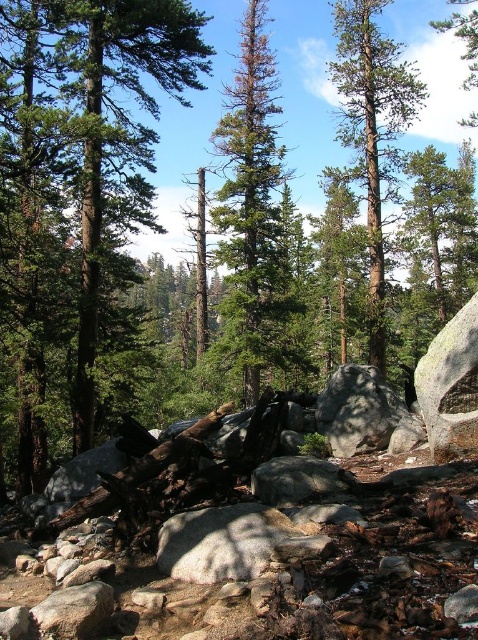
You are an environmental scientist assessing the forest. You observe the green leafy tree at center and the green textured tree at center. Which tree has a narrower trunk?

The green leafy tree at center has a lesser width compared to the green textured tree at center, so the green leafy tree at center has a narrower trunk.

You are standing in the forest and see two points marked in the image. Which point is closer to you, point (251, 372) or point (336, 394)?

Point (251, 372) is closer to you because it is further to the camera than point (336, 394).